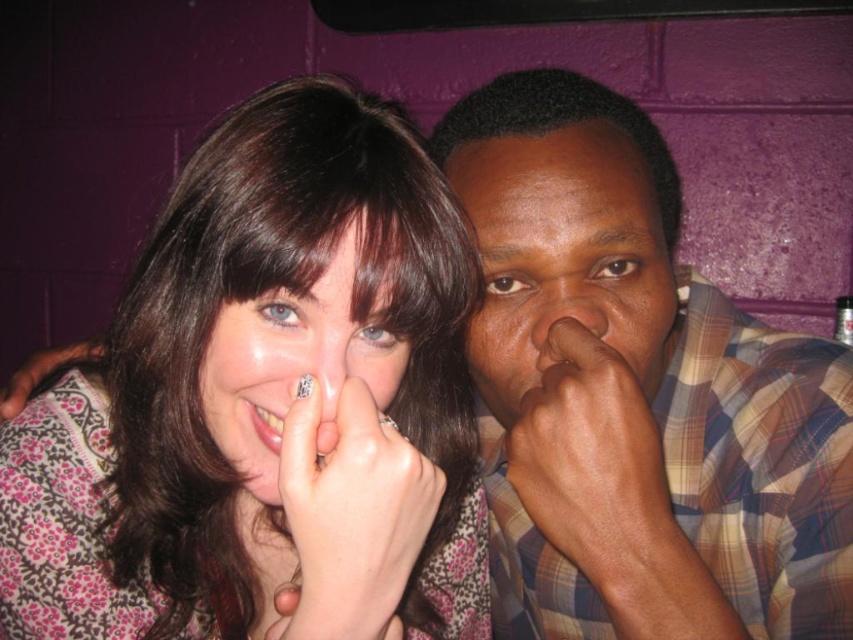
You are a photographer trying to capture the white painted nails at center represented by point (350,516). The camera you are using has a 50mm lens with a field of view of 46 degrees. Given that the two individuals are standing 3 meters apart from each other, will the white painted nails at center be entirely visible in the camera frame?

The white painted nails at center represented by point (350,516) are positioned between the two individuals who are 3 meters apart. Since the camera has a 50mm lens with a 46 degree field of view, the field of view at 3 meters would cover approximately 2.4 meters width. The distance between the individuals is within this width, so the white painted nails at center should be entirely visible in the camera frame.